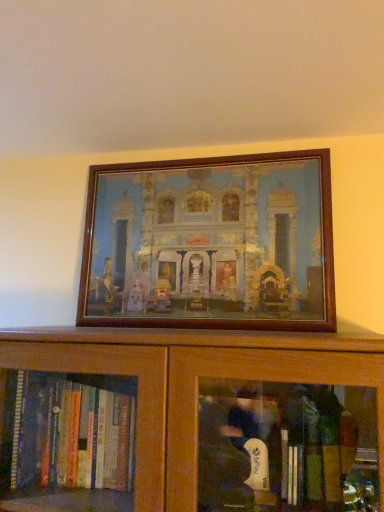
You are a GUI agent. You are given a task and a screenshot of the screen. Output one action in this format:
    pyautogui.click(x=<x>, y=<y>)
    Task: Click on the blank space above wooden picture frame at upper center (from a real-world perspective)
    The image size is (384, 512).
    Given the screenshot: What is the action you would take?
    pyautogui.click(x=205, y=157)